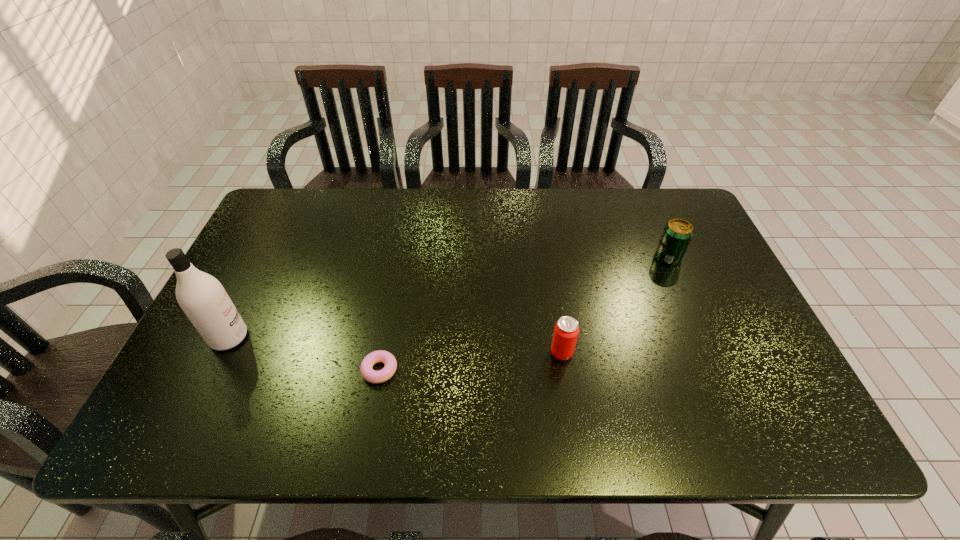
Find the location of `free space that is in between the leftmost object and the left beer can`. free space that is in between the leftmost object and the left beer can is located at coordinates (396, 345).

You are a GUI agent. You are given a task and a screenshot of the screen. Output one action in this format:
    pyautogui.click(x=<x>, y=<y>)
    Task: Click on the empty space that is in between the shampoo and the left beer can
    The width and height of the screenshot is (960, 540).
    Given the screenshot: What is the action you would take?
    pyautogui.click(x=396, y=345)

Where is `empty space between the shortest object and the nearer beer can`? empty space between the shortest object and the nearer beer can is located at coordinates (470, 361).

Identify the location of free spot between the second object from left to right and the farthest object. This screenshot has height=540, width=960. (524, 313).

The image size is (960, 540). Find the location of `free space that is in between the left beer can and the farther beer can`. free space that is in between the left beer can and the farther beer can is located at coordinates (615, 305).

This screenshot has width=960, height=540. I want to click on vacant space that is in between the farthest object and the leftmost object, so click(448, 297).

Find the location of `free space that is in between the farther beer can and the leftmost object`. free space that is in between the farther beer can and the leftmost object is located at coordinates (448, 297).

Where is `free point between the second object from right to left and the right beer can`? free point between the second object from right to left and the right beer can is located at coordinates click(615, 305).

At what (x,y) coordinates should I click in order to perform the action: click on vacant area between the doughnut and the nearer beer can. Please return your answer as a coordinate pair (x, y). Looking at the image, I should click on (470, 361).

The height and width of the screenshot is (540, 960). I want to click on vacant region between the doughnut and the rightmost object, so click(x=524, y=313).